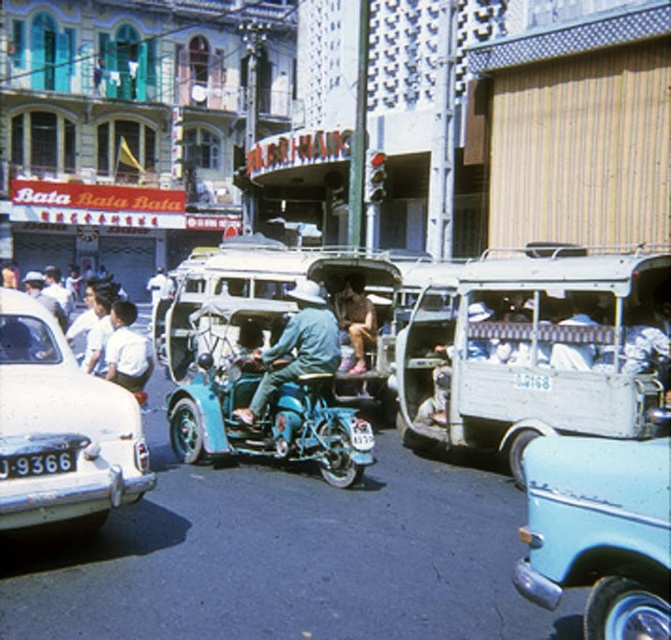
You are a delivery person needing to place a small package on the ground between the white glossy car at lower left and the denim jacket at center. Considering their sizes, will the space between them be sufficient for the package?

The white glossy car at lower left is larger in size than the denim jacket at center. Since the car is bigger, the space between them might be adequate for the package, but exact dimensions aren

You are a delivery person needing to cross the street quickly. There is a light blue plastic tricycle at center and a white glossy car at lower left. Can you safely pass between them without going too close? The minimum safe distance for passing is 15 feet.

The distance between the light blue plastic tricycle at center and the white glossy car at lower left is 15.54 feet, which is just over the 15 feet minimum safe distance. Yes, you can safely pass between them without going too close.